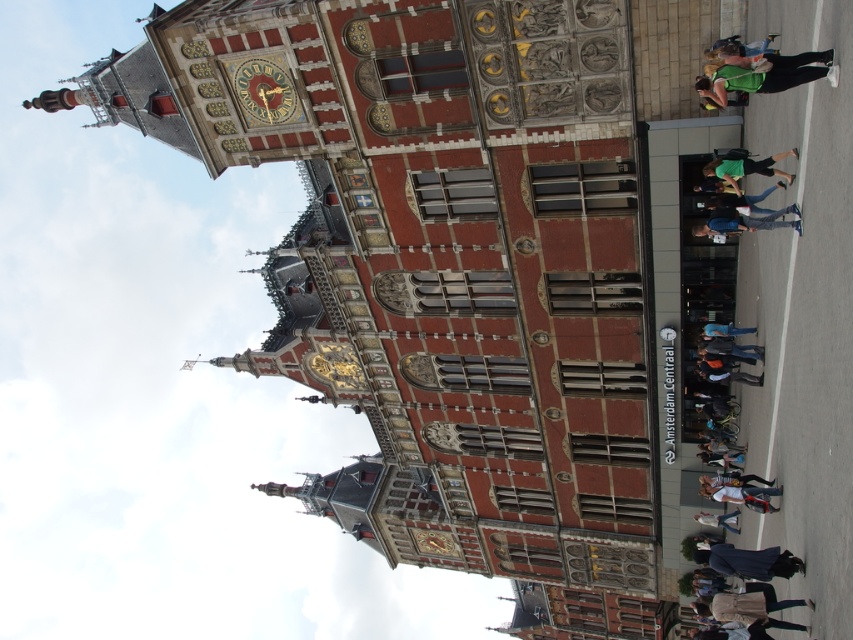
Question: Which of these objects is positioned farthest from the white shirt at lower right?

Choices:
 (A) blue denim jeans at center
 (B) blue denim jeans at lower right
 (C) gold metallic clock at upper center

Answer: (C)

Question: Does gold metallic clock at upper center have a greater width compared to blue denim jeans at center?

Choices:
 (A) yes
 (B) no

Answer: (A)

Question: Can you confirm if dark blue fabric coat at lower right is positioned to the left of blue denim jeans at center?

Choices:
 (A) yes
 (B) no

Answer: (B)

Question: Which point is farther to the camera?

Choices:
 (A) click(697, 516)
 (B) click(721, 76)
 (C) click(691, 234)

Answer: (A)

Question: Does green fabric bag at upper right have a larger size compared to dark blue fabric coat at lower right?

Choices:
 (A) yes
 (B) no

Answer: (B)

Question: Among these points, which one is farthest from the camera?

Choices:
 (A) (x=732, y=209)
 (B) (x=730, y=176)

Answer: (A)